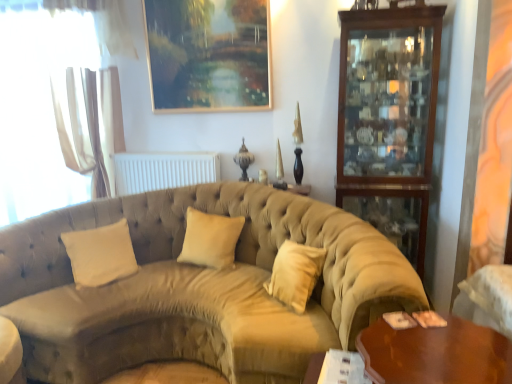
Describe the element at coordinates (389, 105) in the screenshot. I see `mahogany wood cabinet at right` at that location.

Based on the photo, what is the approximate width of mahogany wood cabinet at right?

mahogany wood cabinet at right is 15.26 inches wide.

What is the approximate height of white fabric armchair at lower right?

It is 17.55 inches.

You are a GUI agent. You are given a task and a screenshot of the screen. Output one action in this format:
    pyautogui.click(x=<x>, y=<y>)
    Task: Click on the gold-framed painting at upper center
    The width and height of the screenshot is (512, 384).
    Given the screenshot: What is the action you would take?
    pyautogui.click(x=208, y=54)

What do you see at coordinates (198, 288) in the screenshot? This screenshot has height=384, width=512. I see `velvet beige couch at center` at bounding box center [198, 288].

This screenshot has height=384, width=512. What do you see at coordinates (100, 254) in the screenshot?
I see `white velvet pillow at center, the 2th pillow viewed from the right` at bounding box center [100, 254].

At what (x,y) coordinates should I click in order to perform the action: click on white velvet pillow at center, the 2th pillow viewed from the right. Please return your answer as a coordinate pair (x, y). This screenshot has height=384, width=512. Looking at the image, I should click on (100, 254).

What do you see at coordinates (163, 170) in the screenshot?
I see `white matte radiator at center` at bounding box center [163, 170].

Identify the location of beige fabric pillow at center, the 2th pillow viewed from the left. (210, 239).

I want to click on white sheer curtain at left, so click(x=37, y=106).

Find the location of `mahogany wood cabinet at right`. mahogany wood cabinet at right is located at coordinates (389, 105).

Consider the image. Which of these two, white sheer curtain at left or white fabric armchair at lower right, stands taller?

Standing taller between the two is white sheer curtain at left.

How different are the orientations of white sheer curtain at left and white fabric armchair at lower right in degrees?

white sheer curtain at left and white fabric armchair at lower right are facing 93.3 degrees away from each other.

Is point (65, 9) less distant than point (484, 267)?

No, (65, 9) is further to viewer.

Considering the relative positions of white sheer curtain at left and white fabric armchair at lower right in the image provided, is white sheer curtain at left to the right of white fabric armchair at lower right from the viewer's perspective?

In fact, white sheer curtain at left is to the left of white fabric armchair at lower right.

Is point (475, 301) positioned before point (321, 225)?

Yes, point (475, 301) is closer to viewer.

Looking at this image, from a real-world perspective, between white fabric armchair at lower right and velvet beige couch at center, who is vertically higher?

From a 3D spatial view, white fabric armchair at lower right is above.

Is white fabric armchair at lower right situated inside velvet beige couch at center or outside?

white fabric armchair at lower right is not enclosed by velvet beige couch at center.

Which object is closer to the camera, shiny brown wooden table at lower right or white fabric armchair at lower right?

shiny brown wooden table at lower right is more forward.

From a real-world perspective, does shiny brown wooden table at lower right sit lower than white fabric armchair at lower right?

Yes.

Does shiny brown wooden table at lower right have a lesser height compared to white fabric armchair at lower right?

Correct, shiny brown wooden table at lower right is not as tall as white fabric armchair at lower right.

Considering the positions of points (442, 382) and (468, 282), is point (442, 382) farther from camera compared to point (468, 282)?

No, (442, 382) is in front of (468, 282).

At what (x,y) coordinates should I click in order to perform the action: click on the 2nd pillow counting from the right of the white sheer curtain at left. Please return your answer as a coordinate pair (x, y). Looking at the image, I should click on coord(210,239).

Is beige fabric pillow at center, the 2th pillow viewed from the left, outside of white sheer curtain at left?

Yes, beige fabric pillow at center, the 2th pillow viewed from the left, is located beyond the bounds of white sheer curtain at left.

Who is taller, beige fabric pillow at center, the 2th pillow viewed from the left, or white sheer curtain at left?

white sheer curtain at left is taller.

Which object is closer to the camera, beige fabric pillow at center, the 1th pillow from the right, or white sheer curtain at left?

beige fabric pillow at center, the 1th pillow from the right, is closer to the camera.

Consider the image. Considering the positions of objects gold-framed painting at upper center and beige fabric pillow at center, the 2th pillow viewed from the left, in the image provided, who is more to the right, gold-framed painting at upper center or beige fabric pillow at center, the 2th pillow viewed from the left,?

From the viewer's perspective, beige fabric pillow at center, the 2th pillow viewed from the left, appears more on the right side.

Is point (214, 45) farther from viewer compared to point (185, 252)?

Yes, it is behind point (185, 252).

From the image's perspective, who appears lower, gold-framed painting at upper center or beige fabric pillow at center, the 2th pillow viewed from the left?

beige fabric pillow at center, the 2th pillow viewed from the left.

Is gold-framed painting at upper center positioned beyond the bounds of beige fabric pillow at center, the 2th pillow viewed from the left?

gold-framed painting at upper center lies outside beige fabric pillow at center, the 2th pillow viewed from the left,'s area.

From the image's perspective, is shiny brown wooden table at lower right beneath white matte radiator at center?

Yes, from the image's perspective, shiny brown wooden table at lower right is below white matte radiator at center.

In the scene shown: In terms of size, does shiny brown wooden table at lower right appear bigger or smaller than white matte radiator at center?

shiny brown wooden table at lower right is bigger than white matte radiator at center.

Does shiny brown wooden table at lower right contain white matte radiator at center?

No, white matte radiator at center is located outside of shiny brown wooden table at lower right.

Is shiny brown wooden table at lower right thinner than white matte radiator at center?

No.

Can you tell me how much white matte radiator at center and white sheer curtain at left differ in facing direction?

The angular difference between white matte radiator at center and white sheer curtain at left is 0.000941 degrees.

In terms of height, does white matte radiator at center look taller or shorter compared to white sheer curtain at left?

white matte radiator at center is shorter than white sheer curtain at left.

Is point (176, 167) more distant than point (14, 17)?

That is True.

Is white matte radiator at center positioned with its back to white sheer curtain at left?

That's not correct — white matte radiator at center is not looking away from white sheer curtain at left.

This screenshot has width=512, height=384. Identify the location of armchair below the white sheer curtain at left (from a real-world perspective). (487, 298).

I want to click on studio couch behind the white fabric armchair at lower right, so (198, 288).

Estimate the real-world distances between objects in this image. Which object is further from white velvet pillow at center, the 2th pillow viewed from the right, white matte radiator at center or white sheer curtain at left?

Among the two, white sheer curtain at left is located further to white velvet pillow at center, the 2th pillow viewed from the right.

Estimate the real-world distances between objects in this image. Which object is further from white sheer curtain at left, mahogany wood cabinet at right or shiny brown wooden table at lower right?

Based on the image, shiny brown wooden table at lower right appears to be further to white sheer curtain at left.

Estimate the real-world distances between objects in this image. Which object is further from white sheer curtain at left, white fabric armchair at lower right or beige fabric pillow at center, the 1th pillow from the right?

The object further to white sheer curtain at left is white fabric armchair at lower right.

Considering their positions, is white matte radiator at center positioned closer to white sheer curtain at left than beige fabric pillow at center, the 2th pillow viewed from the left?

white matte radiator at center lies closer to white sheer curtain at left than the other object.

Looking at the image, which one is located closer to white matte radiator at center, beige fabric pillow at center, the 1th pillow from the right, or gold-framed painting at upper center?

beige fabric pillow at center, the 1th pillow from the right, is positioned closer to the anchor white matte radiator at center.

Looking at the image, which one is located further to mahogany wood cabinet at right, beige fabric pillow at center, the 2th pillow viewed from the left, or white velvet pillow at center, arranged as the first pillow when viewed from the left?

white velvet pillow at center, arranged as the first pillow when viewed from the left.

In the scene shown: Considering their positions, is white sheer curtain at left positioned closer to white fabric armchair at lower right than white velvet pillow at center, the 2th pillow viewed from the right?

The object closer to white fabric armchair at lower right is white velvet pillow at center, the 2th pillow viewed from the right.

Which object lies further to the anchor point white fabric armchair at lower right, white velvet pillow at center, the 2th pillow viewed from the right, or white sheer curtain at left?

white sheer curtain at left lies further to white fabric armchair at lower right than the other object.

Image resolution: width=512 pixels, height=384 pixels. In order to click on curtain between velvet beige couch at center and white matte radiator at center in the front-back direction in this screenshot , I will do `click(89, 122)`.

The height and width of the screenshot is (384, 512). Identify the location of curtain between white sheer curtain at left and white matte radiator at center from left to right. (89, 122).

The image size is (512, 384). Identify the location of pillow between velvet beige couch at center and mahogany wood cabinet at right. (x=210, y=239).

Find the location of a particular element. curtain positioned between velvet beige couch at center and white sheer curtain at left from near to far is located at coordinates (89, 122).